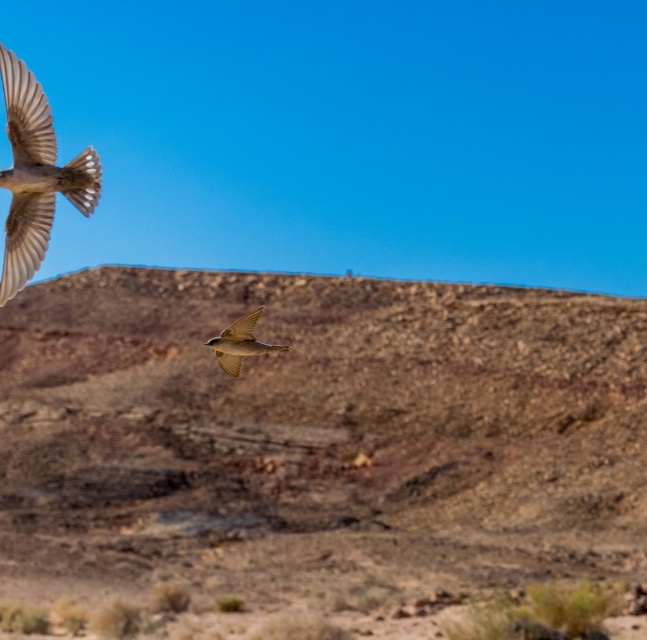
You are a hiker planning to traverse the rugged landscape shown in the image. There is a point marked at coordinates point(320, 428). What is the nature of the terrain at this point?

The point at coordinates point(320, 428) marks brown rocky terrain at center, which is part of the rugged, earthy landscape described in the scene. This terrain is likely challenging to traverse due to its rocky and uneven nature.

You are a photographer trying to capture the brown feathered bird at center while ensuring the brown rocky terrain at center is also visible in the frame. Based on their sizes, which object should you focus on to ensure both are in the frame?

The brown rocky terrain at center is larger than the brown feathered bird at center, so focusing on the brown rocky terrain at center will help ensure both are in the frame since it occupies more space in the image.

You are an ornithologist observing two brown feathered birds in flight. You notice the brown feathered bird at upper left and the brown feathered bird at center. Which bird has a larger wingspan based on their size in the image?

The brown feathered bird at upper left is bigger than the brown feathered bird at center, so it likely has a larger wingspan.